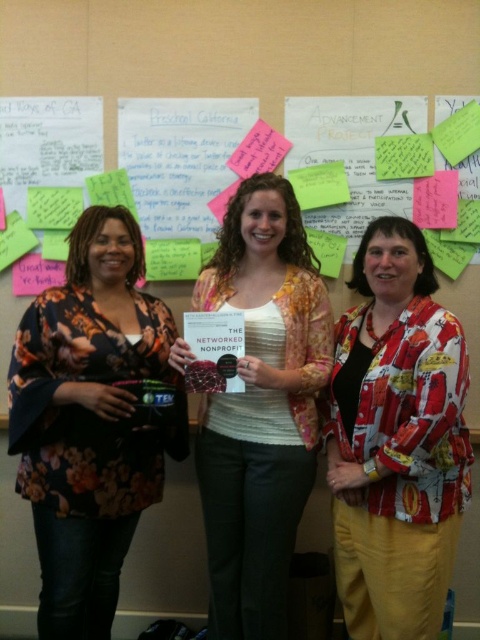
Question: Is printed fabric blouse at center to the right of floral fabric blouse at center from the viewer's perspective?

Choices:
 (A) no
 (B) yes

Answer: (B)

Question: Does floral kimono at left have a smaller size compared to floral fabric blouse at center?

Choices:
 (A) no
 (B) yes

Answer: (B)

Question: Does floral kimono at left have a larger size compared to floral fabric blouse at center?

Choices:
 (A) no
 (B) yes

Answer: (A)

Question: Which point appears farthest from the camera in this image?

Choices:
 (A) (284, 412)
 (B) (113, 570)

Answer: (B)

Question: Among these objects, which one is nearest to the camera?

Choices:
 (A) floral fabric blouse at center
 (B) printed fabric blouse at center

Answer: (B)

Question: Which of the following is the closest to the observer?

Choices:
 (A) (84, 492)
 (B) (415, 332)

Answer: (B)